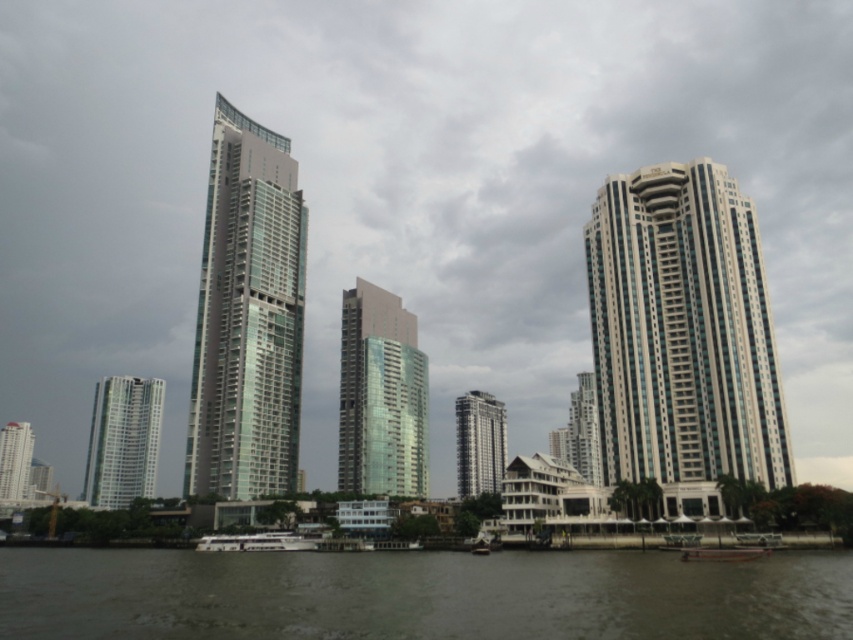
Does transparent glass building at center have a lesser width compared to matte white building at lower left?

Correct, transparent glass building at center's width is less than matte white building at lower left's.

The height and width of the screenshot is (640, 853). Describe the element at coordinates (381, 394) in the screenshot. I see `transparent glass building at center` at that location.

You are a GUI agent. You are given a task and a screenshot of the screen. Output one action in this format:
    pyautogui.click(x=<x>, y=<y>)
    Task: Click on the transparent glass building at center
    This screenshot has height=640, width=853.
    Given the screenshot: What is the action you would take?
    pyautogui.click(x=381, y=394)

Looking at this image, which of these two, matte white building at lower left or metallic silver boat at lower center, stands shorter?

Standing shorter between the two is metallic silver boat at lower center.

You are a GUI agent. You are given a task and a screenshot of the screen. Output one action in this format:
    pyautogui.click(x=<x>, y=<y>)
    Task: Click on the matte white building at lower left
    This screenshot has width=853, height=640.
    Given the screenshot: What is the action you would take?
    pyautogui.click(x=15, y=460)

This screenshot has height=640, width=853. What are the coordinates of `matte white building at lower left` in the screenshot? It's located at (15, 460).

Between glassy metallic skyscraper at center and metallic silver boat at lower center, which one appears on the right side from the viewer's perspective?

Positioned to the right is metallic silver boat at lower center.

Which is in front, point (263, 180) or point (720, 557)?

Positioned in front is point (720, 557).

This screenshot has height=640, width=853. I want to click on glassy metallic skyscraper at center, so click(247, 316).